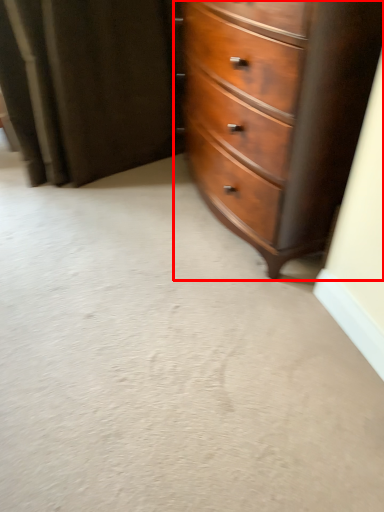
Question: From the image's perspective, what is the correct spatial relationship of chest of drawers (annotated by the red box) in relation to curtain?

Choices:
 (A) below
 (B) above

Answer: (A)